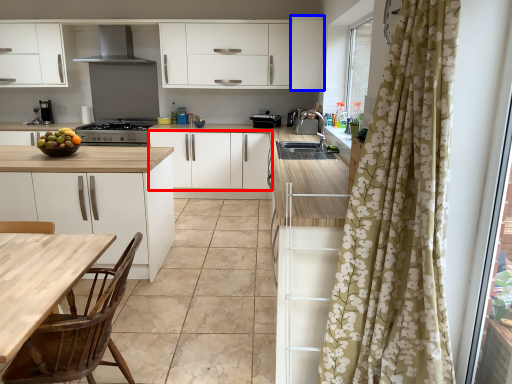
Question: Which of the following is the closest to the observer, cabinetry (highlighted by a red box) or cabinetry (highlighted by a blue box)?

Choices:
 (A) cabinetry
 (B) cabinetry

Answer: (B)